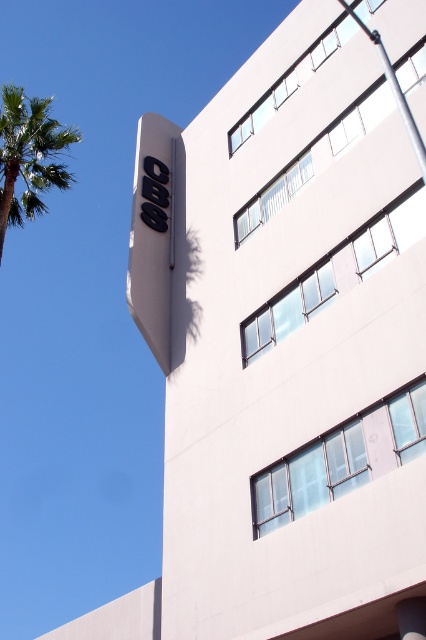
You are standing at the base of the building and want to take a photo of the CBS sign. There are two points marked on the building facade at coordinates point (20, 99) and point (423, 176). Which point is closer to the CBS sign?

Point (20, 99) is behind point (423, 176), so the closer point to the CBS sign would be point (423, 176) since it is in front.

What are the coordinates of the black matte sign at upper left?

The coordinates of the black matte sign at upper left are at point [152,234].